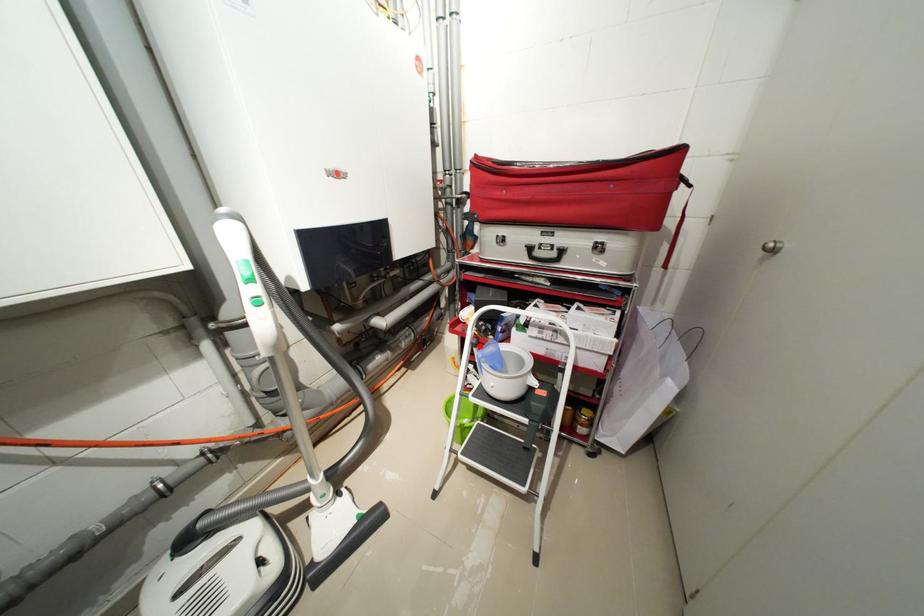
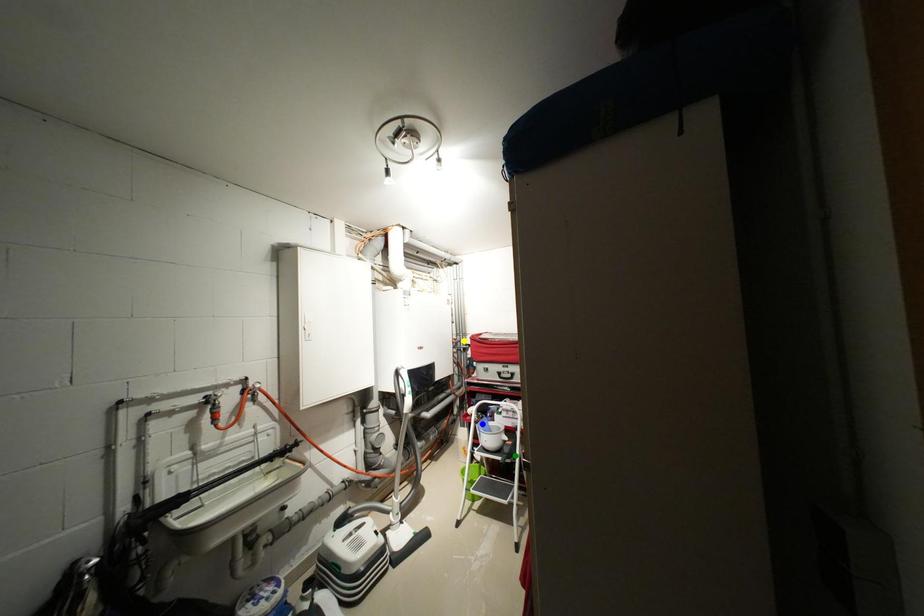
Question: I am providing you with two images of the same scene from different viewpoints. A red point is marked on the first image. You are given multiple points on the second image. Which point in image 2 represents the same 3d spot as the red point in image 1?

Choices:
 (A) green point
 (B) blue point
 (C) yellow point

Answer: (B)